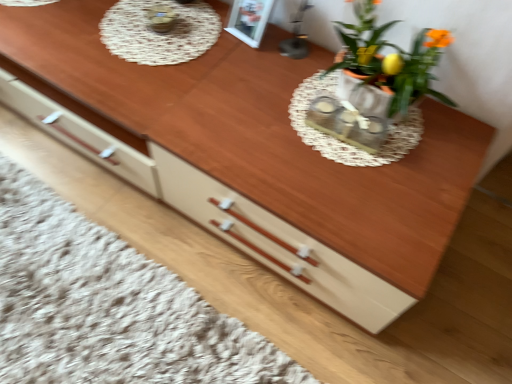
Question: In terms of width, does matte orange pot at upper right look wider or thinner when compared to white lace doily at upper center?

Choices:
 (A) thin
 (B) wide

Answer: (A)

Question: Is matte orange pot at upper right situated inside white lace doily at upper center or outside?

Choices:
 (A) outside
 (B) inside

Answer: (A)

Question: Which object is the farthest from the matte orange pot at upper right?

Choices:
 (A) matte white flowerpot at upper right
 (B) white lace doily at upper center

Answer: (B)

Question: Which object is the closest to the white lace doily at upper center?

Choices:
 (A) matte white flowerpot at upper right
 (B) matte orange pot at upper right

Answer: (B)